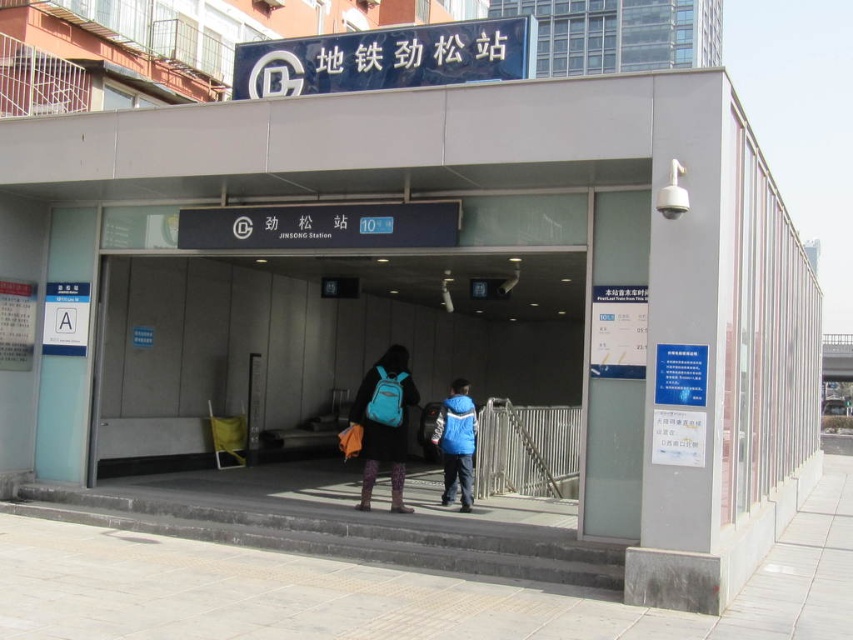
Between point (363, 477) and point (439, 440), which one is positioned behind?

Positioned behind is point (439, 440).

Is point (374, 371) closer to camera compared to point (451, 440)?

Yes, it is in front of point (451, 440).

Locate an element on the screen. matte blue backpack at center is located at coordinates (384, 422).